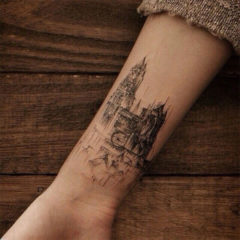
Where is `wood grain`? The image size is (240, 240). wood grain is located at coordinates (85, 46), (58, 102), (186, 199).